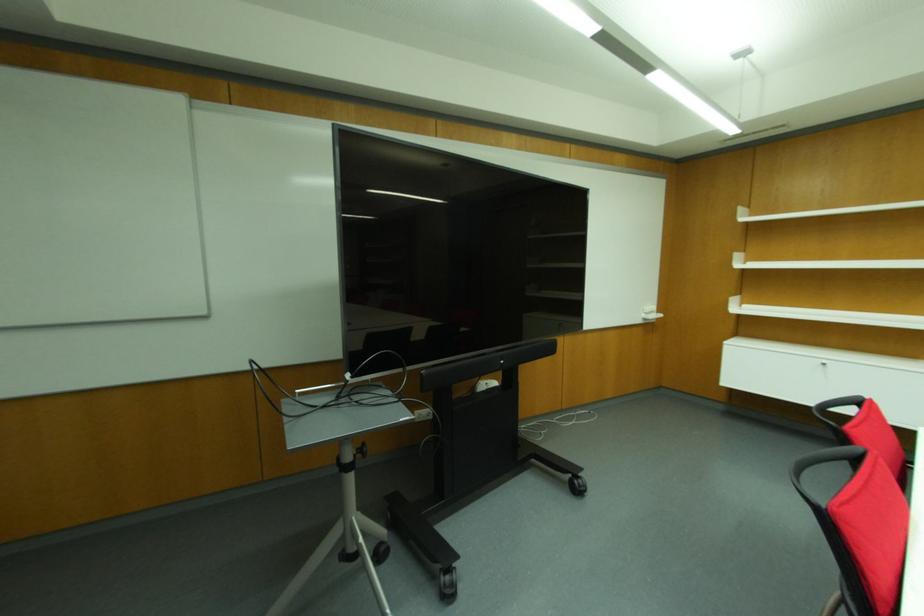
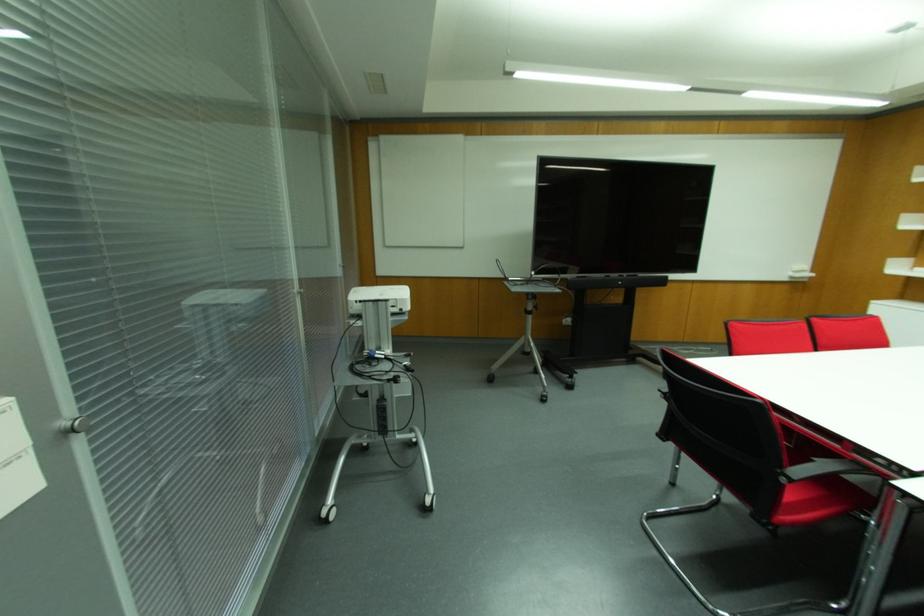
In the second image, find the point that corresponds to (661,315) in the first image.

(811, 274)